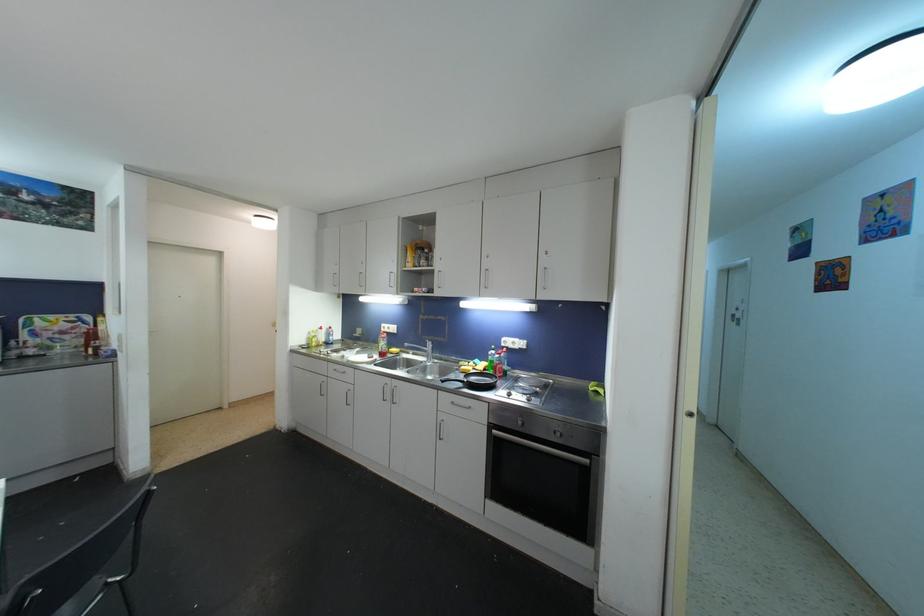
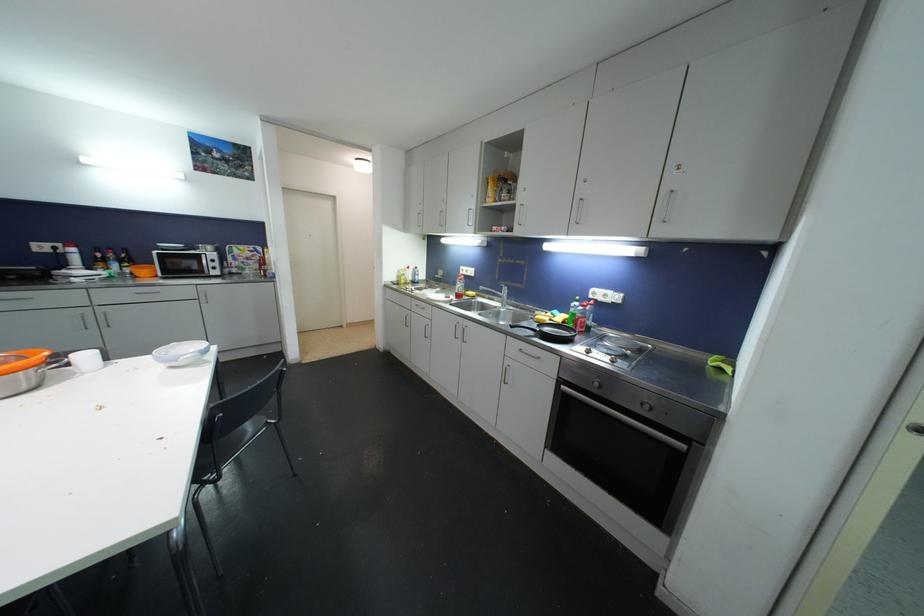
In the second image, find the point that corresponds to the point at 470,378 in the first image.

(544, 326)